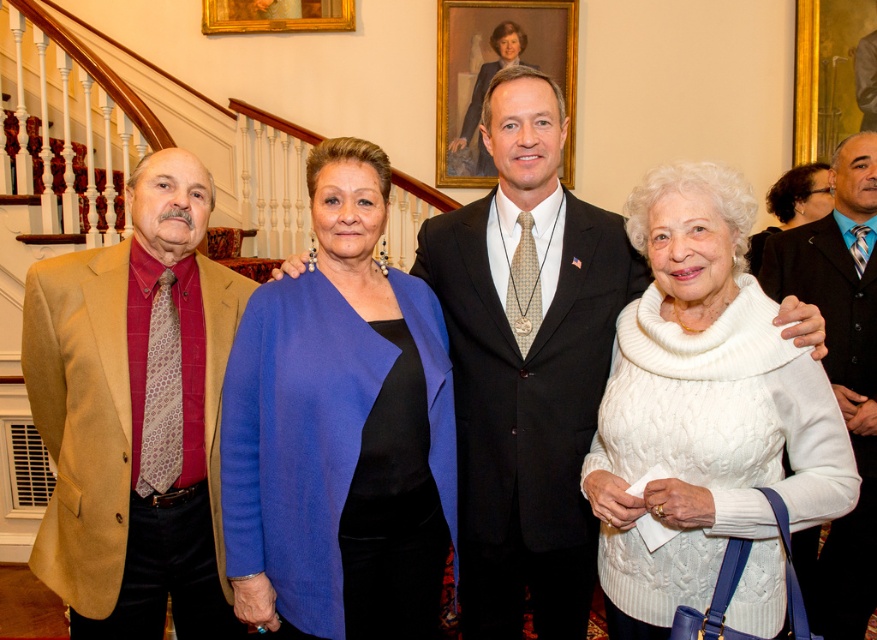
Question: Which object is farther from the camera taking this photo?

Choices:
 (A) gold/gilded picture frame at upper center
 (B) goldwooden frame at upper center
 (C) white cable-knit sweater at center

Answer: (B)

Question: Is blue woolen jacket at center to the right of dark blue suit at center from the viewer's perspective?

Choices:
 (A) yes
 (B) no

Answer: (B)

Question: Does gold/gilded picture frame at upper center have a smaller size compared to black shiny hair at upper right?

Choices:
 (A) yes
 (B) no

Answer: (B)

Question: Among these points, which one is nearest to the camera?

Choices:
 (A) (488, 72)
 (B) (569, 344)

Answer: (B)

Question: Can you confirm if dark blue suit at center is wider than black shiny hair at upper right?

Choices:
 (A) no
 (B) yes

Answer: (B)

Question: Which object is farther from the camera taking this photo?

Choices:
 (A) goldwooden frame at upper center
 (B) white cable-knit sweater at center

Answer: (A)